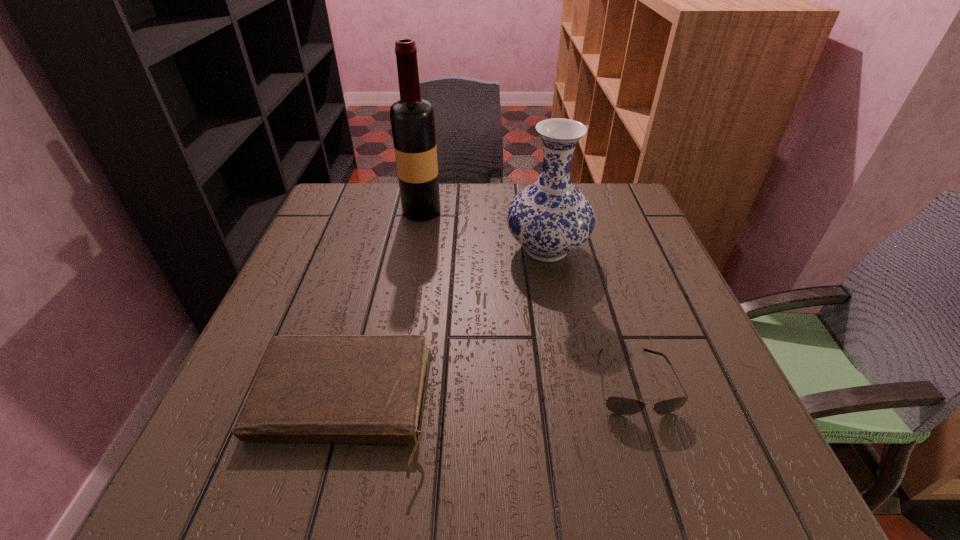
The width and height of the screenshot is (960, 540). I want to click on free area in between the sunglasses and the tallest object, so click(x=527, y=296).

The height and width of the screenshot is (540, 960). I want to click on free space that is in between the wine bottle and the sunglasses, so point(527,296).

What are the coordinates of `empty space between the tallest object and the paperback book` in the screenshot? It's located at (382, 310).

Where is `empty space that is in between the sunglasses and the tallest object`? The image size is (960, 540). empty space that is in between the sunglasses and the tallest object is located at coordinates (527, 296).

What are the coordinates of `free space between the second farthest object and the wine bottle` in the screenshot? It's located at (484, 230).

At what (x,y) coordinates should I click in order to perform the action: click on vacant space that's between the sunglasses and the paperback book. Please return your answer as a coordinate pair (x, y). Looking at the image, I should click on (488, 395).

Where is `free space between the wine bottle and the sunglasses`? free space between the wine bottle and the sunglasses is located at coordinates (527, 296).

You are a GUI agent. You are given a task and a screenshot of the screen. Output one action in this format:
    pyautogui.click(x=<x>, y=<y>)
    Task: Click on the blank region between the paperback book and the farthest object
    This screenshot has height=540, width=960.
    Given the screenshot: What is the action you would take?
    pyautogui.click(x=382, y=310)

At what (x,y) coordinates should I click in order to perform the action: click on free point between the vase and the tallest object. Please return your answer as a coordinate pair (x, y). The width and height of the screenshot is (960, 540). Looking at the image, I should click on (484, 230).

This screenshot has width=960, height=540. Identify the location of free space that is in between the sunglasses and the paperback book. (488, 395).